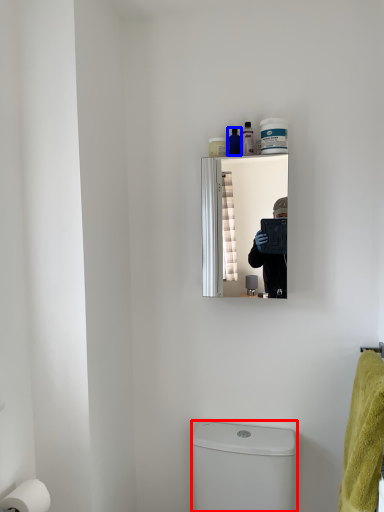
Question: Which object is further to the camera taking this photo, toilet bowl (highlighted by a red box) or toiletry (highlighted by a blue box)?

Choices:
 (A) toilet bowl
 (B) toiletry

Answer: (B)